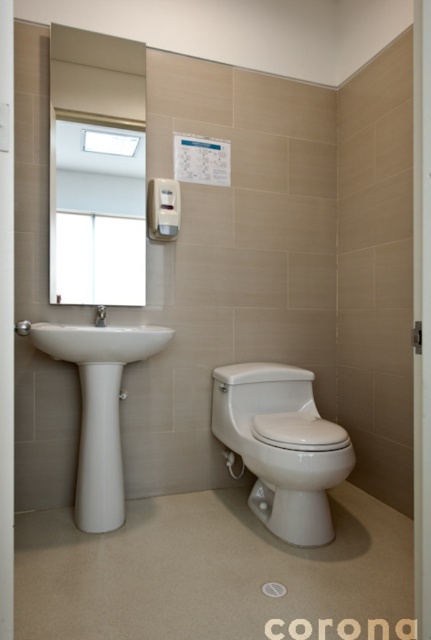
Who is positioned more to the right, white glossy sink at left or white glossy faucet at left?

white glossy sink at left

Who is shorter, white glossy sink at left or white glossy faucet at left?

white glossy faucet at left

At what (x,y) coordinates should I click in order to perform the action: click on white glossy sink at left. Please return your answer as a coordinate pair (x, y). The height and width of the screenshot is (640, 431). Looking at the image, I should click on (99, 342).

Is the position of white glossy sink at left less distant than that of matte white shower at lower left?

No.

Between point (86, 324) and point (27, 321), which one is positioned behind?

The point (86, 324) is more distant.

You are a GUI agent. You are given a task and a screenshot of the screen. Output one action in this format:
    pyautogui.click(x=<x>, y=<y>)
    Task: Click on the white glossy sink at left
    Image resolution: width=431 pixels, height=640 pixels.
    Given the screenshot: What is the action you would take?
    pyautogui.click(x=99, y=342)

Identify the location of white glossy toilet at lower right. (281, 445).

Is point (240, 368) closer to viewer compared to point (84, 328)?

No.

Identify the location of white glossy toilet at lower right. (281, 445).

Locate an element on the screen. white glossy toilet at lower right is located at coordinates (281, 445).